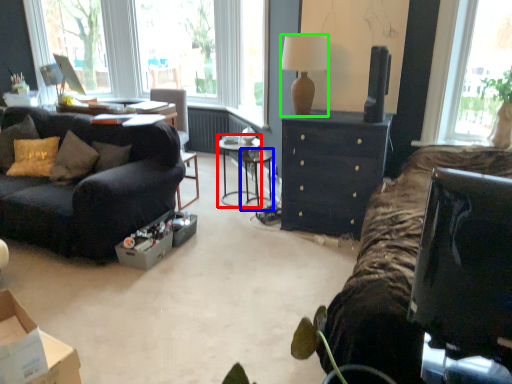
Question: Considering the real-world distances, which object is farthest from side table (highlighted by a red box)? table (highlighted by a blue box) or lamp (highlighted by a green box)?

Choices:
 (A) table
 (B) lamp

Answer: (B)